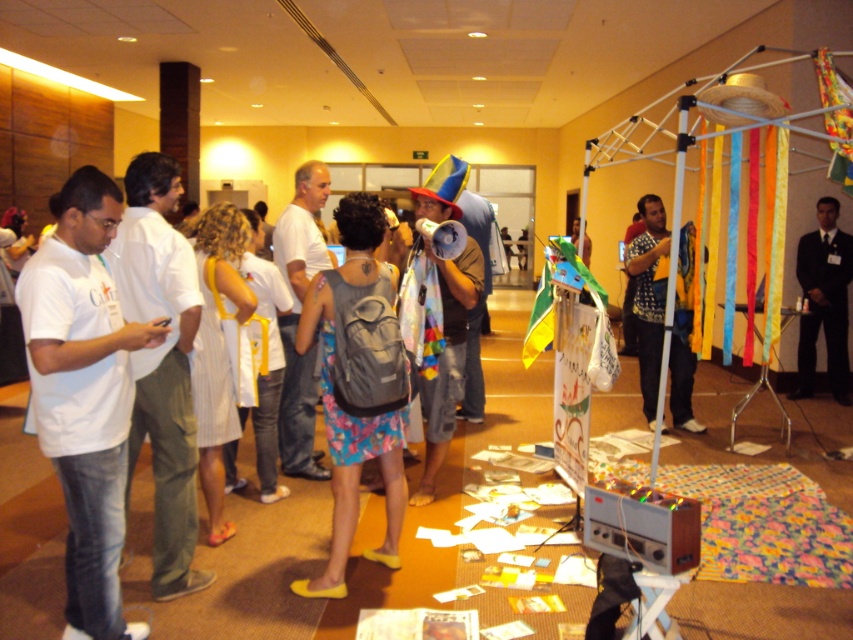
You are standing at the entrance of the hall and want to locate the gray fabric backpack at center. According to the coordinates provided, in which direction should you move from your current position to find it?

The gray fabric backpack at center is located at coordinates point [358,384]. Since you are at the entrance, you should move towards the center of the hall to reach it.